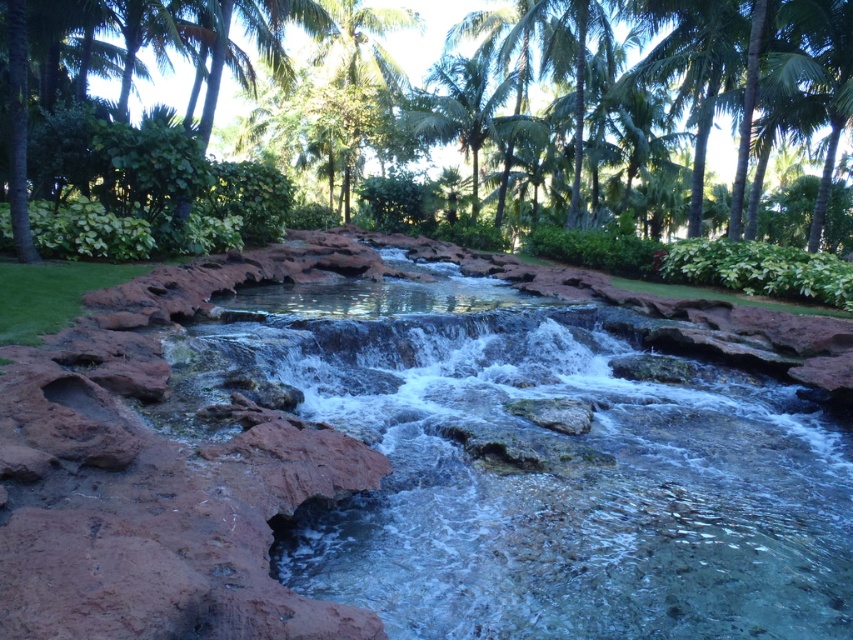
Question: Is green leafy tree at center smaller than green leafy palm tree at upper center?

Choices:
 (A) no
 (B) yes

Answer: (A)

Question: Which object appears closest to the camera in this image?

Choices:
 (A) clear water at center
 (B) green leafy palm tree at upper center
 (C) green leafy tree at center

Answer: (A)

Question: Estimate the real-world distances between objects in this image. Which object is farther from the clear water at center?

Choices:
 (A) green leafy tree at center
 (B) green leafy palm tree at upper center

Answer: (B)

Question: Is clear water at center above green leafy tree at center?

Choices:
 (A) yes
 (B) no

Answer: (B)

Question: Which is farther from the green leafy palm tree at upper center?

Choices:
 (A) clear water at center
 (B) green leafy tree at center

Answer: (A)

Question: Does clear water at center have a lesser width compared to green leafy palm tree at upper center?

Choices:
 (A) no
 (B) yes

Answer: (A)